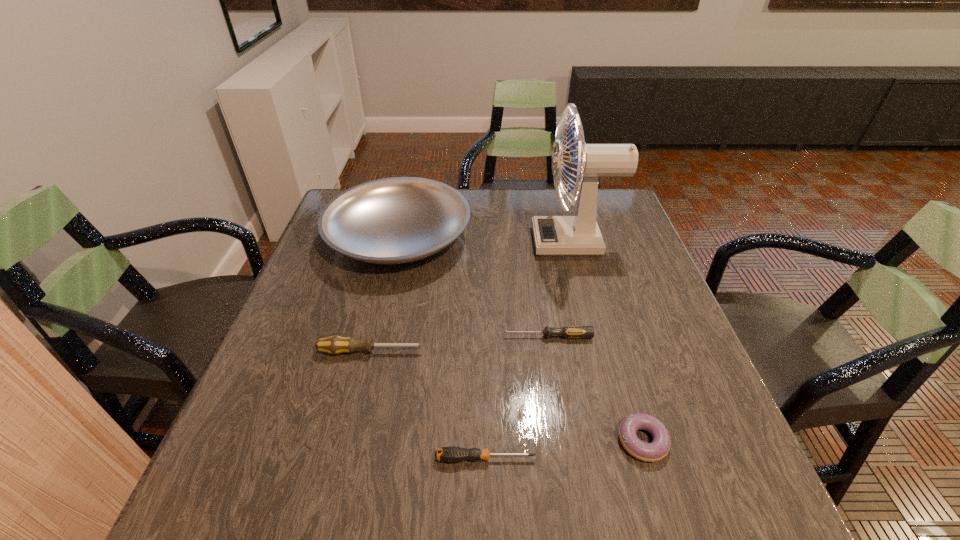
The width and height of the screenshot is (960, 540). I want to click on vacant space located 0.370m on the right of the second tallest object, so click(600, 238).

Where is `vacant area located 0.360m at the tip of the leftmost screwdriver`? This screenshot has height=540, width=960. vacant area located 0.360m at the tip of the leftmost screwdriver is located at coordinates (593, 352).

Locate an element on the screen. Image resolution: width=960 pixels, height=540 pixels. free region located on the left of the doughnut is located at coordinates (473, 441).

Locate an element on the screen. Image resolution: width=960 pixels, height=540 pixels. free space located 0.050m insert the farthest screwdriver into a screw head is located at coordinates (482, 336).

I want to click on blank area located 0.140m insert the farthest screwdriver into a screw head, so click(x=442, y=336).

Find the location of a particular element. free spot located insert the farthest screwdriver into a screw head is located at coordinates (356, 336).

Identify the location of free region located 0.150m on the right of the nearest screwdriver. (621, 458).

This screenshot has width=960, height=540. In order to click on fan positioned at the far edge in this screenshot , I will do `click(579, 235)`.

Image resolution: width=960 pixels, height=540 pixels. What are the coordinates of `bedpan located in the far edge section of the desktop` in the screenshot? It's located at (396, 220).

I want to click on bedpan located at the left edge, so click(x=396, y=220).